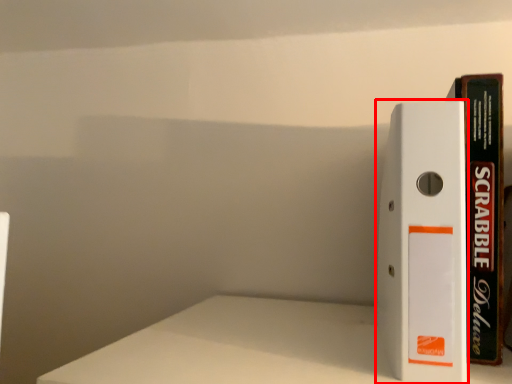
Question: Where is book (annotated by the red box) located in relation to book in the image?

Choices:
 (A) left
 (B) right

Answer: (A)